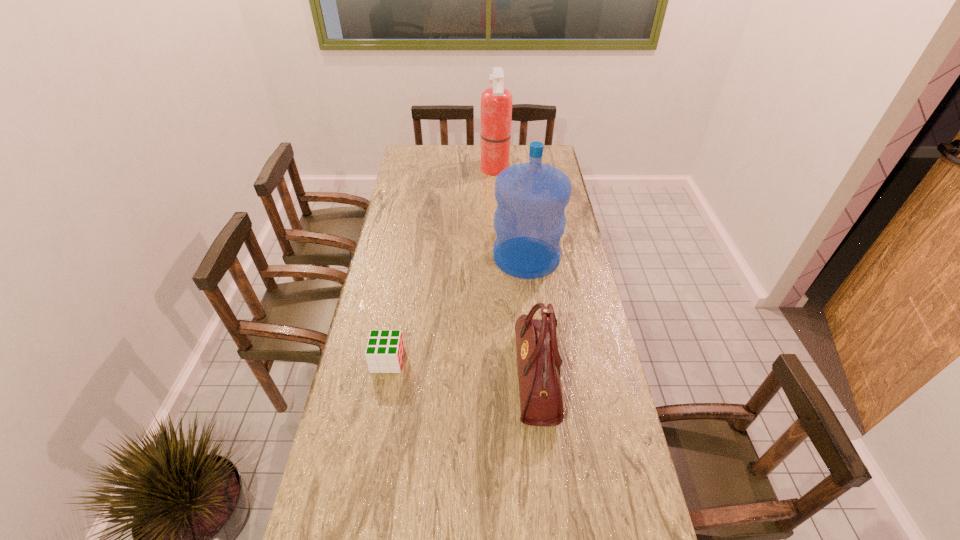
Find the location of a particular element. The width and height of the screenshot is (960, 540). fire extinguisher is located at coordinates (496, 102).

The width and height of the screenshot is (960, 540). Find the location of `water jug`. water jug is located at coordinates (529, 221).

This screenshot has width=960, height=540. Identify the location of the third tallest object. (541, 404).

Where is `the shortest object`? The image size is (960, 540). the shortest object is located at coordinates (384, 353).

Identify the location of cube. This screenshot has height=540, width=960. (384, 353).

Identify the location of vacant space situated 0.370m with the handle and hose on the fire extinguisher. (406, 170).

You are a GUI agent. You are given a task and a screenshot of the screen. Output one action in this format:
    pyautogui.click(x=<x>, y=<y>)
    Task: Click on the vacant area situated with the handle and hose on the fire extinguisher
    The width and height of the screenshot is (960, 540).
    Given the screenshot: What is the action you would take?
    pyautogui.click(x=462, y=170)

The image size is (960, 540). Find the location of `vacant point located with the handle and hose on the fire extinguisher`. vacant point located with the handle and hose on the fire extinguisher is located at coordinates (418, 170).

This screenshot has width=960, height=540. Find the location of `vacant region located on the back of the second farthest object`. vacant region located on the back of the second farthest object is located at coordinates (518, 191).

Image resolution: width=960 pixels, height=540 pixels. Find the location of `free space located on the front-facing side of the third tallest object`. free space located on the front-facing side of the third tallest object is located at coordinates (467, 377).